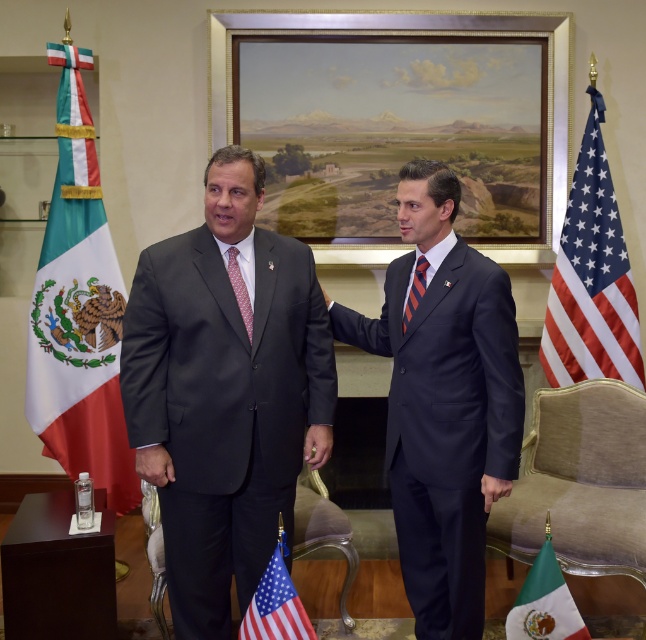
Looking at this image, you are a photographer setting up for a formal portrait. You need to ensure that the textured fabric flag at left and the red silk tie at center are both visible in the frame. Given their sizes, which object will require more space in the composition?

The textured fabric flag at left requires more space in the composition because it has a larger size compared to the red silk tie at center.

You are a photographer standing in front of the dark blue suit at center. You want to take a closeup photo of the suit without moving the subject. Can you step forward to get closer?

The dark blue suit at center and viewer are 2.11 meters apart. Since you can move forward, you can step closer to take the closeup photo.